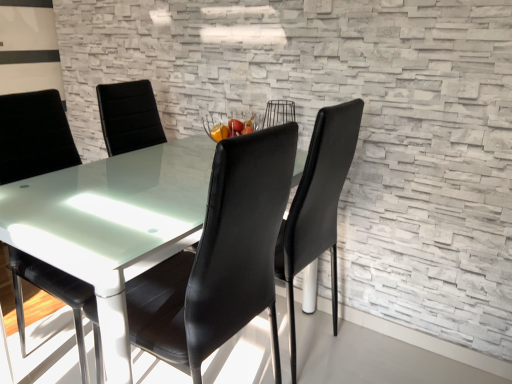
Question: Looking at their shapes, would you say black leather chair at left, the first chair in the left-to-right sequence, is wider or thinner than black leather chair at center, the 2th chair when ordered from left to right?

Choices:
 (A) wide
 (B) thin

Answer: (A)

Question: Relative to black leather chair at center, the 2th chair when ordered from left to right, is black leather chair at left, positioned as the second chair in right-to-left order, in front or behind?

Choices:
 (A) behind
 (B) front

Answer: (A)

Question: From the image's perspective, relative to black leather chair at center, the 2th chair when ordered from left to right, is black leather chair at left, the first chair in the left-to-right sequence, above or below?

Choices:
 (A) above
 (B) below

Answer: (A)

Question: Is black leather chair at center, the 2th chair when ordered from left to right, inside or outside of black leather chair at left, positioned as the second chair in right-to-left order?

Choices:
 (A) inside
 (B) outside

Answer: (B)

Question: Looking at the image, does black leather chair at center, which appears as the 1th chair when viewed from the right, seem bigger or smaller compared to black leather chair at left, positioned as the second chair in right-to-left order?

Choices:
 (A) small
 (B) big

Answer: (A)

Question: Relative to black leather chair at left, positioned as the second chair in right-to-left order, is black leather chair at center, the 2th chair when ordered from left to right, in front or behind?

Choices:
 (A) front
 (B) behind

Answer: (A)

Question: Considering the positions of point (241, 317) and point (35, 261), is point (241, 317) closer or farther from the camera than point (35, 261)?

Choices:
 (A) farther
 (B) closer

Answer: (B)